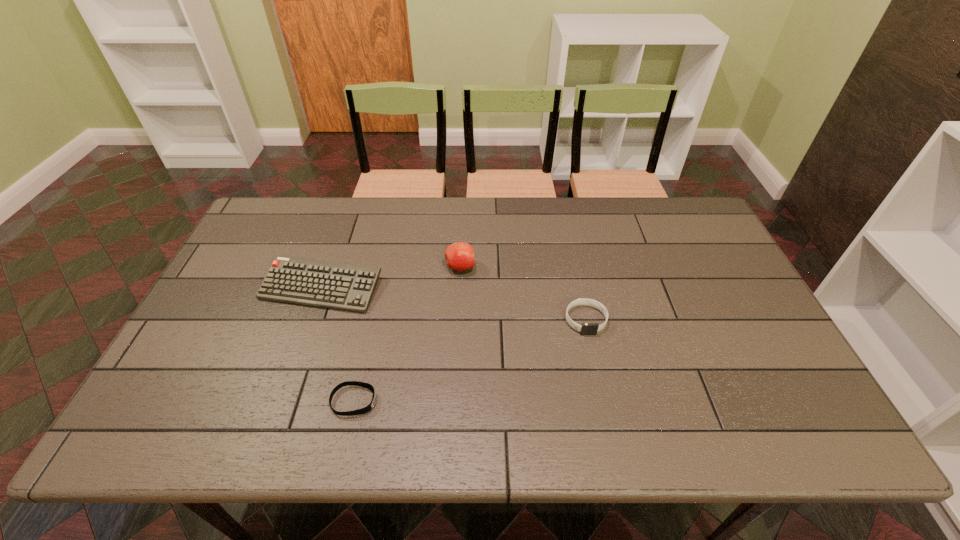
Find the location of a particular element. The height and width of the screenshot is (540, 960). free point that satisfies the following two spatial constraints: 1. on the outer surface of the third tallest object; 2. on the display of the shortest object is located at coordinates (603, 401).

The width and height of the screenshot is (960, 540). In order to click on free space that satisfies the following two spatial constraints: 1. on the back side of the computer keyboard; 2. on the left side of the tallest object in this screenshot , I will do `click(329, 267)`.

Image resolution: width=960 pixels, height=540 pixels. What are the coordinates of `vacant space that satisfies the following two spatial constraints: 1. on the front side of the tallest object; 2. on the display of the nearest object` in the screenshot? It's located at (454, 401).